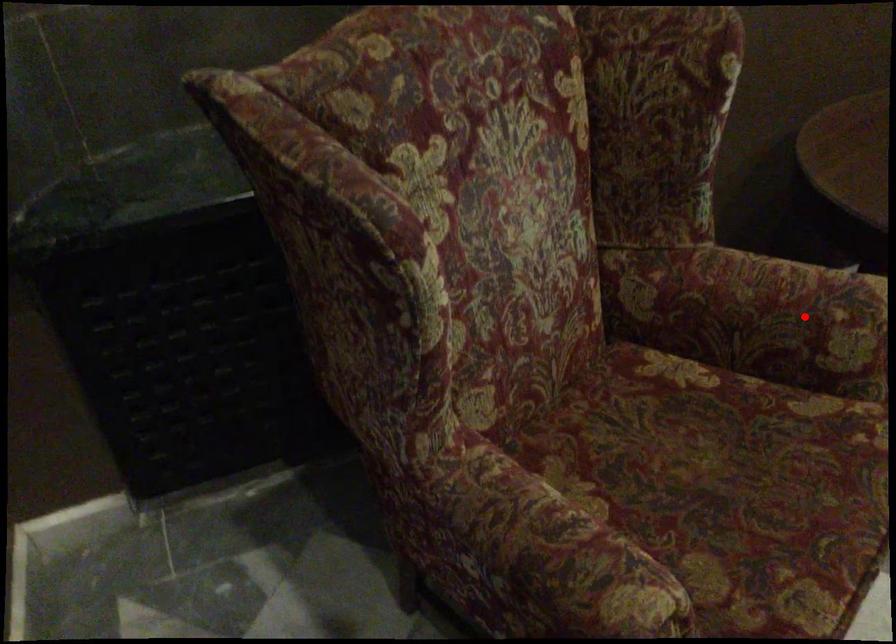
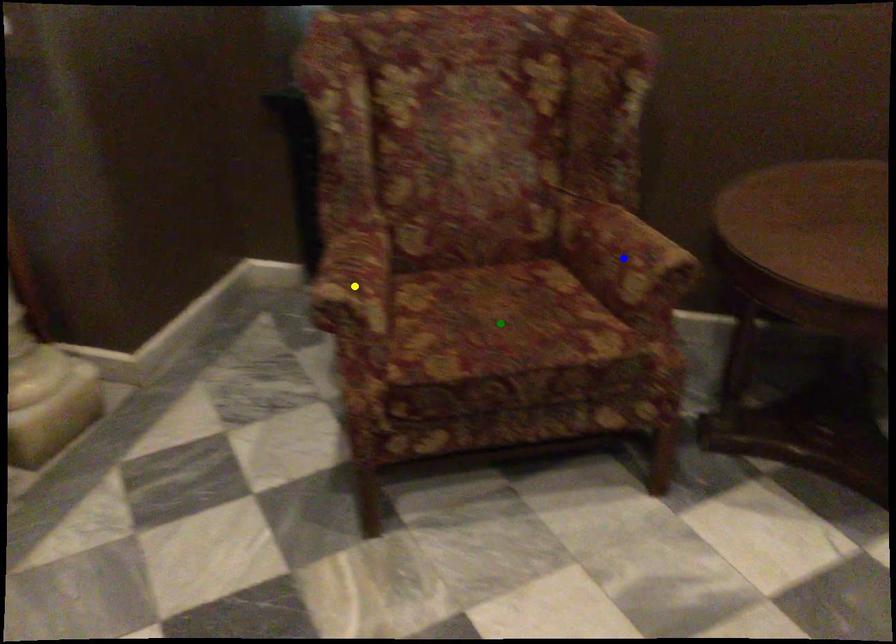
Question: I am providing you with two images of the same scene from different viewpoints. A red point is marked on the first image. You are given multiple points on the second image. In image 2, which mark is for the same physical point as the one in image 1?

Choices:
 (A) blue point
 (B) yellow point
 (C) green point

Answer: (A)